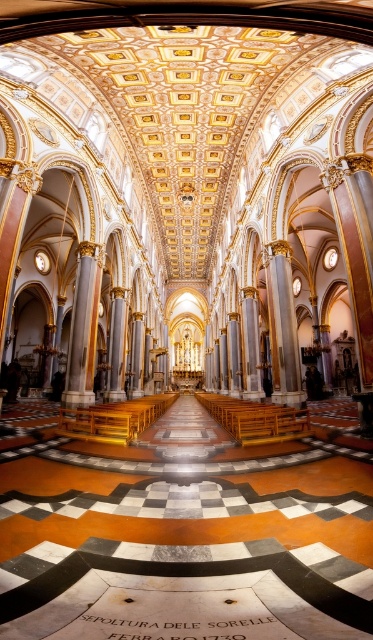
Can you confirm if gold polished pillar at center is positioned below slate gray stone pillar at center?

Incorrect, gold polished pillar at center is not positioned below slate gray stone pillar at center.

Does gold polished pillar at center have a larger size compared to slate gray stone pillar at center?

Yes.

Identify the location of gold polished pillar at center. The image size is (373, 640). (283, 326).

Is white marble column at center positioned before slate gray stone pillar at center?

Yes, it is.

Is white marble column at center wider than slate gray stone pillar at center?

Correct, the width of white marble column at center exceeds that of slate gray stone pillar at center.

Who is more distant from viewer, (92, 349) or (114, 352)?

The point (114, 352) is more distant.

This screenshot has width=373, height=640. I want to click on white marble column at center, so click(x=83, y=326).

Which is more to the left, white marble column at center or gold polished pillar at center?

From the viewer's perspective, white marble column at center appears more on the left side.

Can you confirm if white marble column at center is positioned above gold polished pillar at center?

Incorrect, white marble column at center is not positioned above gold polished pillar at center.

What do you see at coordinates (83, 326) in the screenshot? The height and width of the screenshot is (640, 373). I see `white marble column at center` at bounding box center [83, 326].

The height and width of the screenshot is (640, 373). I want to click on white marble column at center, so click(83, 326).